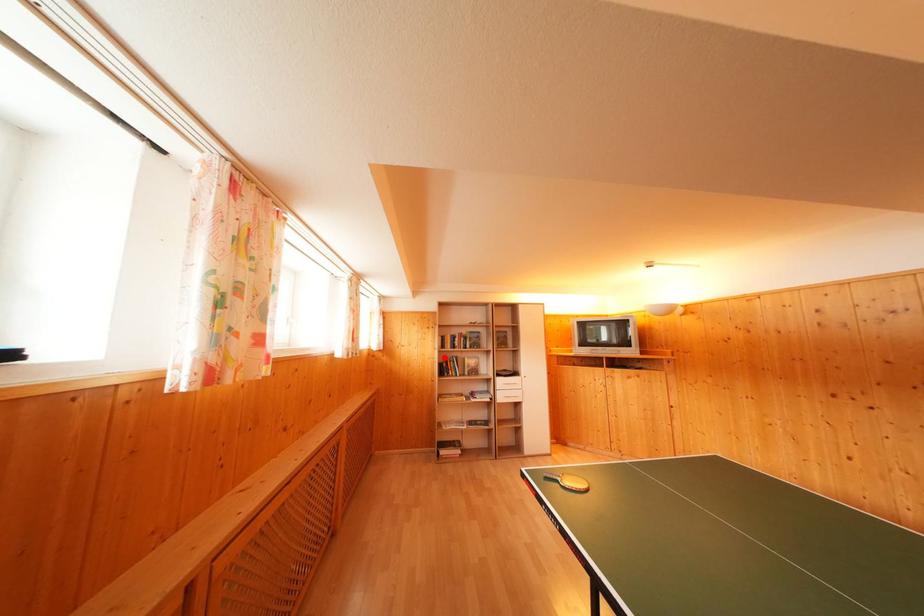
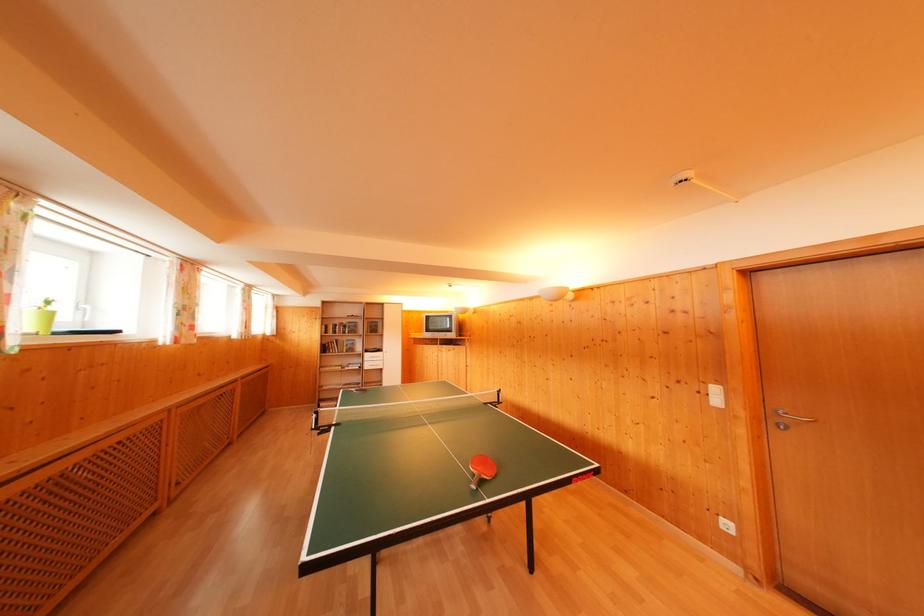
In the second image, find the point that corresponds to the highlighted location in the first image.

(326, 342)